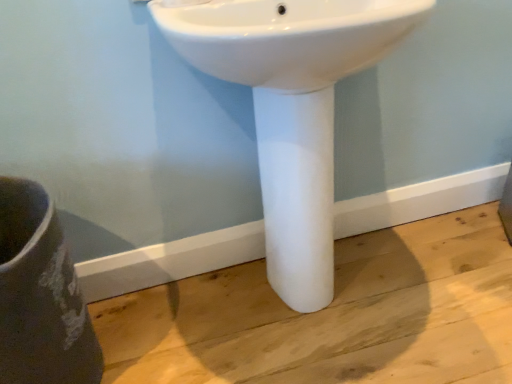
Locate an element on the screen. This screenshot has width=512, height=384. unoccupied region to the right of white glossy sink at center is located at coordinates (443, 277).